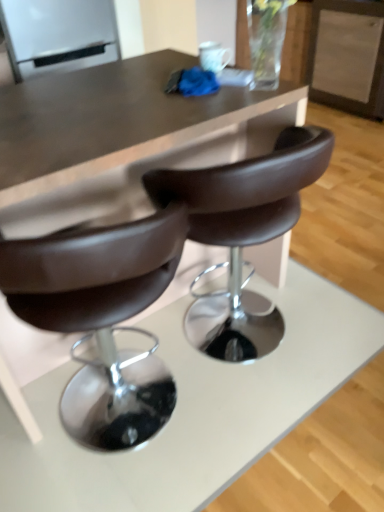
Question: From a real-world perspective, is brown leather chair at center below white glossy refrigerator at upper left?

Choices:
 (A) no
 (B) yes

Answer: (B)

Question: From the image's perspective, is brown leather chair at center beneath white glossy refrigerator at upper left?

Choices:
 (A) no
 (B) yes

Answer: (B)

Question: From the image's perspective, would you say brown leather chair at center is positioned over white glossy refrigerator at upper left?

Choices:
 (A) yes
 (B) no

Answer: (B)

Question: Is brown leather chair at center not near white glossy refrigerator at upper left?

Choices:
 (A) yes
 (B) no

Answer: (A)

Question: Is brown leather chair at center aimed at white glossy refrigerator at upper left?

Choices:
 (A) yes
 (B) no

Answer: (A)

Question: Considering the positions of white glossy refrigerator at upper left and brown leather chair at center in the image, is white glossy refrigerator at upper left bigger or smaller than brown leather chair at center?

Choices:
 (A) small
 (B) big

Answer: (A)

Question: From their relative heights in the image, would you say white glossy refrigerator at upper left is taller or shorter than brown leather chair at center?

Choices:
 (A) tall
 (B) short

Answer: (B)

Question: Is white glossy refrigerator at upper left inside the boundaries of brown leather chair at center, or outside?

Choices:
 (A) outside
 (B) inside

Answer: (A)

Question: From a real-world perspective, is white glossy refrigerator at upper left physically located above or below brown leather chair at center?

Choices:
 (A) below
 (B) above

Answer: (B)

Question: Is matte brown table at center taller or shorter than brown leather chair at center?

Choices:
 (A) short
 (B) tall

Answer: (B)

Question: Considering their positions, is matte brown table at center located in front of or behind brown leather chair at center?

Choices:
 (A) behind
 (B) front

Answer: (B)

Question: Considering the positions of point (11, 88) and point (158, 179), is point (11, 88) closer or farther from the camera than point (158, 179)?

Choices:
 (A) closer
 (B) farther

Answer: (B)

Question: Is matte brown table at center wider or thinner than brown leather chair at center?

Choices:
 (A) thin
 (B) wide

Answer: (B)

Question: Is brown leather chair at center wider or thinner than matte brown table at center?

Choices:
 (A) wide
 (B) thin

Answer: (B)

Question: Considering the positions of brown leather chair at center and matte brown table at center in the image, is brown leather chair at center taller or shorter than matte brown table at center?

Choices:
 (A) tall
 (B) short

Answer: (B)